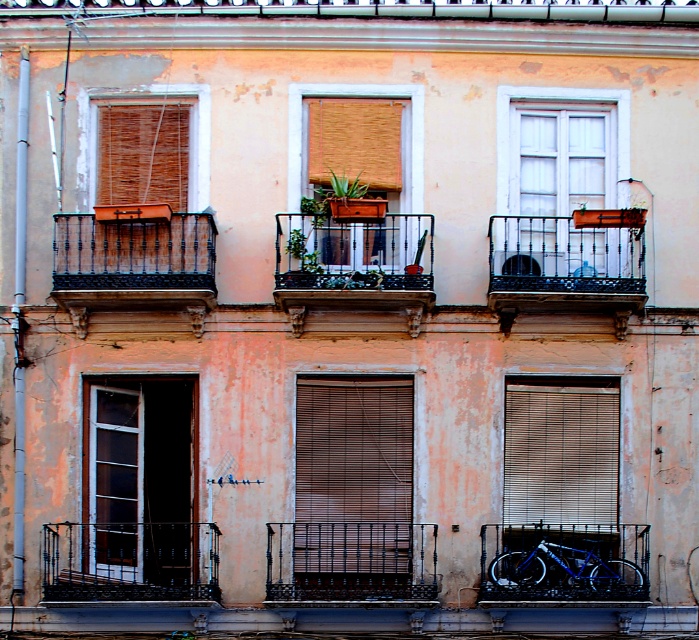
You are standing in front of the building and want to take a photo of the rustic wrought iron balcony at left. Considering the distance, will you need a zoom lens to capture it clearly?

The rustic wrought iron balcony at left is 135.26 feet from the camera, so a zoom lens would be necessary to capture it clearly from that distance.

From the picture: You are standing in front of the building and want to take a photo of the rusty metal balcony at center and the wooden blinds at center. Which one will appear larger in your photo?

The rusty metal balcony at center will appear larger in the photo because it is closer to the viewer than the wooden blinds at center.

You are standing in front of the building and notice the rusty metal balcony at center and the wooden blinds at center. Which object is positioned lower in the scene?

The rusty metal balcony at center is located below the wooden blinds at center, so it is positioned lower in the scene.